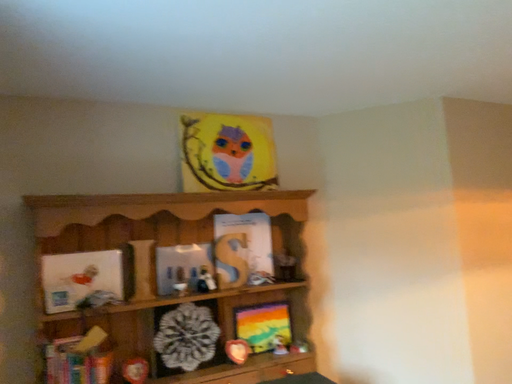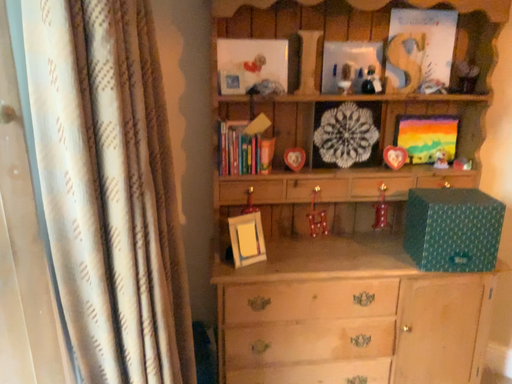
Question: Which way did the camera rotate in the video?

Choices:
 (A) rotated upward
 (B) rotated downward

Answer: (B)